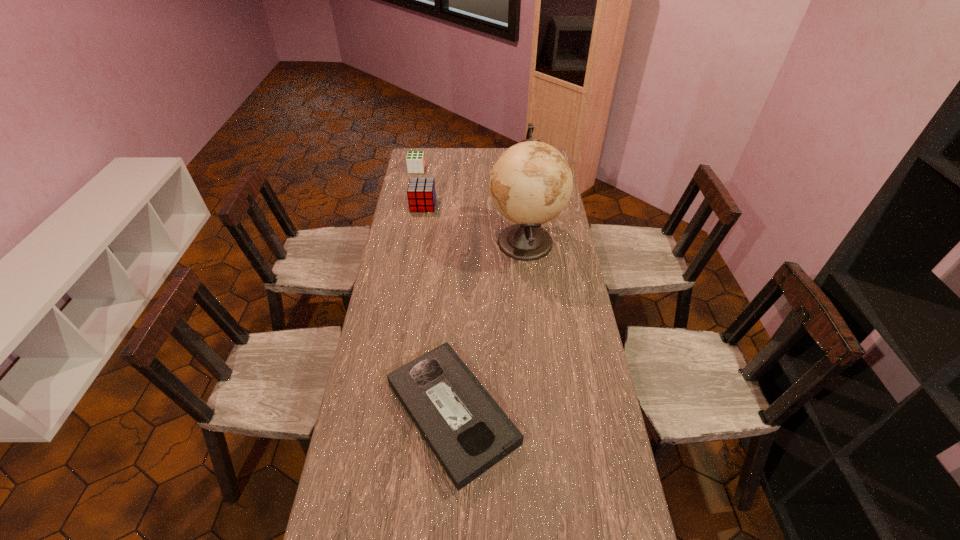
The image size is (960, 540). I want to click on object that is the closest to the second nearest object, so click(x=421, y=194).

Locate an element on the screen. Image resolution: width=960 pixels, height=540 pixels. object identified as the closest to the farther cube is located at coordinates (421, 194).

Locate an element on the screen. free region that satisfies the following two spatial constraints: 1. on the red face of the farther cube; 2. on the right side of the nearer cube is located at coordinates (410, 205).

You are a GUI agent. You are given a task and a screenshot of the screen. Output one action in this format:
    pyautogui.click(x=<x>, y=<y>)
    Task: Click on the free location that satisfies the following two spatial constraints: 1. on the back side of the nearest object; 2. on the red face of the farther cube
    
    Given the screenshot: What is the action you would take?
    coord(464,169)

I want to click on free space that satisfies the following two spatial constraints: 1. on the red face of the shorter cube; 2. on the left side of the videotape, so point(371,413).

This screenshot has width=960, height=540. In order to click on blank space that satisfies the following two spatial constraints: 1. on the red face of the nearest object; 2. on the right side of the shorter cube in this screenshot , I will do `click(371, 413)`.

The width and height of the screenshot is (960, 540). I want to click on free location that satisfies the following two spatial constraints: 1. on the red face of the third tallest object; 2. on the back side of the taller cube, so click(x=410, y=205).

At what (x,y) coordinates should I click in order to perform the action: click on free spot that satisfies the following two spatial constraints: 1. on the red face of the shortest object; 2. on the left side of the farther cube. Please return your answer as a coordinate pair (x, y). This screenshot has height=540, width=960. Looking at the image, I should click on (371, 413).

Where is `free point that satisfies the following two spatial constraints: 1. on the front side of the taller cube; 2. on the left side of the shortest object`? The width and height of the screenshot is (960, 540). free point that satisfies the following two spatial constraints: 1. on the front side of the taller cube; 2. on the left side of the shortest object is located at coordinates (391, 413).